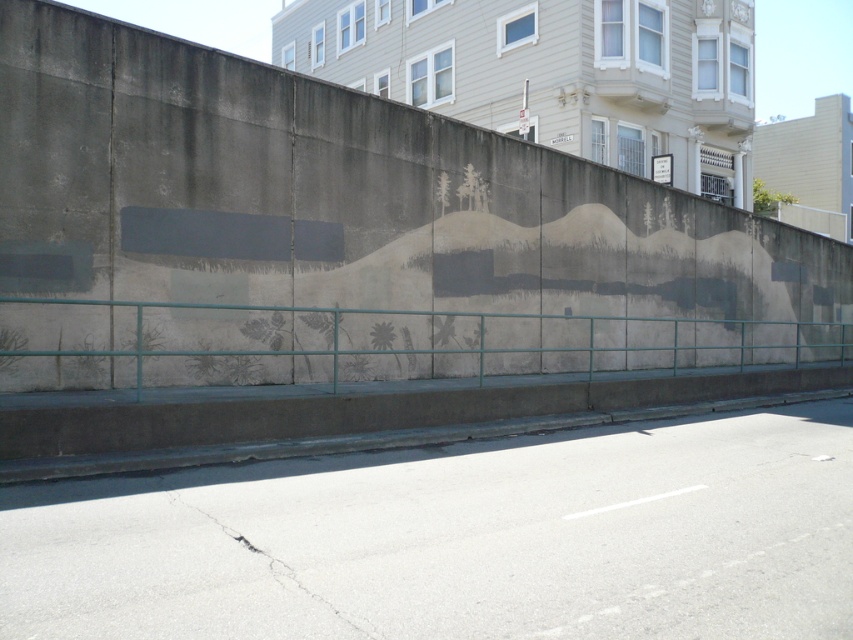
You are standing at the point with coordinates (346, 234). Which object in the scene is located exactly at your current position?

The concrete wall at center is located exactly at the point with coordinates (346, 234).

You are standing on the pavement in front of the concrete wall at center and the teal metal fence at lower center. Which object is positioned higher relative to the other?

The concrete wall at center is positioned higher than the teal metal fence at lower center because it is located above it.

You are standing on the gray asphalt pavement at lower center and want to reach the top of the concrete wall at center. Can you climb up the wall directly from the pavement?

The concrete wall at center is taller than the gray asphalt pavement at lower center, so you cannot climb up the wall directly from the pavement as the height difference may make it difficult without assistance.